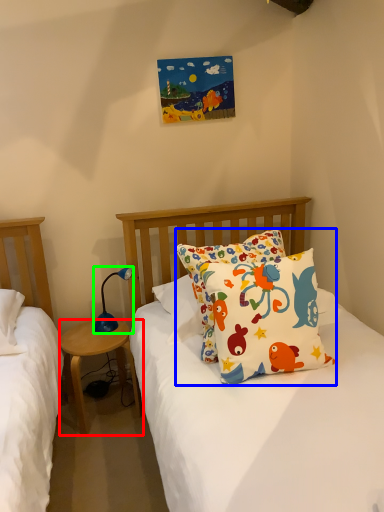
Question: Which is farther away from nightstand (highlighted by a red box)? pillow (highlighted by a blue box) or lamp (highlighted by a green box)?

Choices:
 (A) pillow
 (B) lamp

Answer: (A)